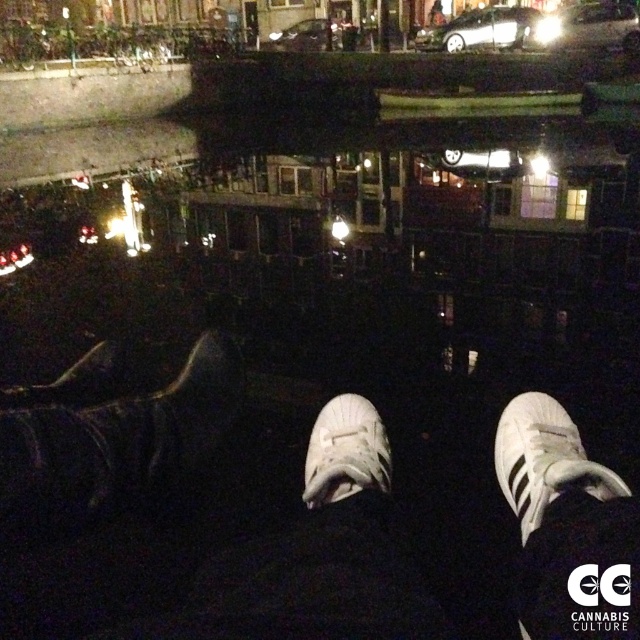
Is white matte shoe at center bigger than shiny silver car at upper right?

No.

From the picture: Is white matte shoe at center taller than shiny silver car at upper right?

No.

Image resolution: width=640 pixels, height=640 pixels. In order to click on white matte shoe at center in this screenshot , I will do 346,451.

Does shiny silver car at upper right have a greater width compared to silver metallic car at upper center?

Yes.

Does shiny silver car at upper right come behind silver metallic car at upper center?

No, shiny silver car at upper right is closer to the viewer.

Which is in front, point (547, 42) or point (536, 12)?

Point (547, 42) is more forward.

What are the coordinates of `shiny silver car at upper right` in the screenshot? It's located at (589, 26).

Does white synthetic sneakers at center have a greater width compared to white synthetic shoe at center?

Correct, the width of white synthetic sneakers at center exceeds that of white synthetic shoe at center.

Is white synthetic sneakers at center further to camera compared to white synthetic shoe at center?

No, white synthetic sneakers at center is in front of white synthetic shoe at center.

Is point (163, 506) positioned in front of point (532, 449)?

No, it is behind (532, 449).

You are a GUI agent. You are given a task and a screenshot of the screen. Output one action in this format:
    pyautogui.click(x=<x>, y=<y>)
    Task: Click on the white synthetic sneakers at center
    
    Given the screenshot: What is the action you would take?
    pyautogui.click(x=177, y=531)